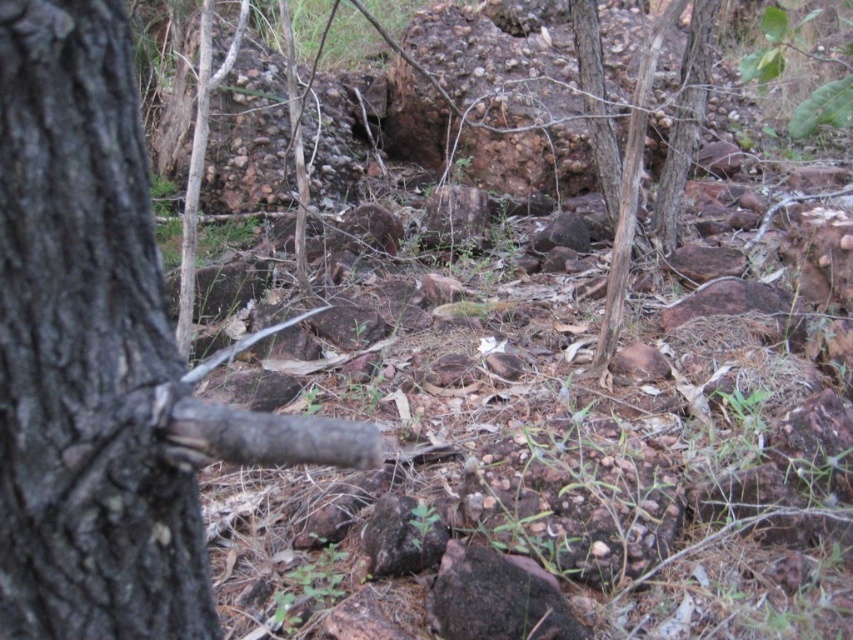
Does dark brown bark tree at left come behind dark brown rough rock at center?

No, dark brown bark tree at left is closer to the viewer.

Which is in front, point (126, 348) or point (461, 625)?

Point (126, 348)

Find the location of a particular element. The width and height of the screenshot is (853, 640). dark brown bark tree at left is located at coordinates (102, 356).

Which is behind, point (15, 436) or point (606, 300)?

Positioned behind is point (606, 300).

Is dark brown bark tree at left above brown rough tree trunk at center?

No.

Between point (4, 112) and point (621, 273), which one is positioned behind?

The point (621, 273) is behind.

I want to click on dark brown bark tree at left, so click(x=102, y=356).

Is point (531, 612) in front of point (613, 138)?

Yes, point (531, 612) is closer to viewer.

Can you confirm if dark brown rough rock at center is positioned to the left of brown rough tree trunk at center?

Indeed, dark brown rough rock at center is positioned on the left side of brown rough tree trunk at center.

Is point (527, 573) positioned in front of point (675, 17)?

That is True.

I want to click on dark brown rough rock at center, so click(497, 598).